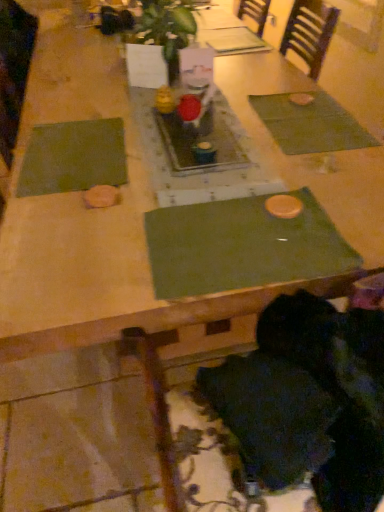
In order to face green fabric placemat at upper right, which is counted as the first place mat, starting from the right, should I rotate leftwards or rightwards?

Rotate your view right by about 15.370°.

This screenshot has height=512, width=384. What do you see at coordinates (166, 25) in the screenshot?
I see `green leafy plant at center` at bounding box center [166, 25].

What do you see at coordinates (241, 246) in the screenshot?
I see `green fabric place mat at center, which appears as the second place mat when viewed from the left` at bounding box center [241, 246].

Describe the element at coordinates (337, 389) in the screenshot. The width and height of the screenshot is (384, 512). I see `black fuzzy hair at lower right` at that location.

At what (x,y) coordinates should I click in order to perform the action: click on green fabric placemat at upper right, the 3th place mat viewed from the left. Please return your answer as a coordinate pair (x, y). Looking at the image, I should click on (310, 124).

Where is `person to the left of green fabric placemat at upper right, which is counted as the first place mat, starting from the right`? Image resolution: width=384 pixels, height=512 pixels. person to the left of green fabric placemat at upper right, which is counted as the first place mat, starting from the right is located at coordinates (337, 389).

Is black fuzzy hair at lower right at the left side of green fabric placemat at upper right, the 3th place mat viewed from the left?

Yes.

Which of these two, black fuzzy hair at lower right or green fabric placemat at upper right, the 3th place mat viewed from the left, is bigger?

black fuzzy hair at lower right is bigger.

How different are the orientations of black fuzzy hair at lower right and green fabric placemat at upper right, which is counted as the first place mat, starting from the right, in degrees?

The angular difference between black fuzzy hair at lower right and green fabric placemat at upper right, which is counted as the first place mat, starting from the right, is 92.6 degrees.

Between green leafy plant at center and green fabric place mat at left, which ranks as the 1th place mat in left-to-right order, which one has smaller width?

green leafy plant at center is thinner.

From the image's perspective, is green leafy plant at center positioned above or below green fabric place mat at left, which ranks as the 1th place mat in left-to-right order?

green leafy plant at center is above green fabric place mat at left, which ranks as the 1th place mat in left-to-right order.

Between green leafy plant at center and green fabric place mat at left, which is counted as the third place mat, starting from the right, which one has more height?

green leafy plant at center is taller.

Are black fuzzy hair at lower right and green fabric place mat at center, which appears as the second place mat when viewed from the left, far apart?

No, black fuzzy hair at lower right is not far away from green fabric place mat at center, which appears as the second place mat when viewed from the left.

From the image's perspective, between black fuzzy hair at lower right and green fabric place mat at center, which is counted as the 2th place mat, starting from the right, who is located below?

black fuzzy hair at lower right, from the image's perspective.

Is black fuzzy hair at lower right smaller than green fabric place mat at center, which appears as the second place mat when viewed from the left?

No.

Which of these two, black fuzzy hair at lower right or green fabric place mat at center, which appears as the second place mat when viewed from the left, is thinner?

With smaller width is green fabric place mat at center, which appears as the second place mat when viewed from the left.

Can you confirm if green fabric placemat at upper right, which is counted as the first place mat, starting from the right, is smaller than green leafy plant at center?

Yes.

Is green fabric placemat at upper right, the 3th place mat viewed from the left, oriented towards green leafy plant at center?

No.

From the image's perspective, is green fabric placemat at upper right, which is counted as the first place mat, starting from the right, above or below green leafy plant at center?

Based on their image positions, green fabric placemat at upper right, which is counted as the first place mat, starting from the right, is located beneath green leafy plant at center.

In the scene shown: Considering the sizes of objects green fabric placemat at upper right, the 3th place mat viewed from the left, and green leafy plant at center in the image provided, who is shorter, green fabric placemat at upper right, the 3th place mat viewed from the left, or green leafy plant at center?

With less height is green fabric placemat at upper right, the 3th place mat viewed from the left.

Can you confirm if black fuzzy hair at lower right is positioned to the left of green leafy plant at center?

In fact, black fuzzy hair at lower right is to the right of green leafy plant at center.

Is the surface of black fuzzy hair at lower right in direct contact with green leafy plant at center?

No.

Find the location of `plant above the black fuzzy hair at lower right (from a real-world perspective)`. plant above the black fuzzy hair at lower right (from a real-world perspective) is located at coordinates (166, 25).

What's the angular difference between black fuzzy hair at lower right and green leafy plant at center's facing directions?

0.224 degrees.

Between green fabric placemat at upper right, the 3th place mat viewed from the left, and green fabric place mat at center, which appears as the second place mat when viewed from the left, which one appears on the left side from the viewer's perspective?

Positioned to the left is green fabric place mat at center, which appears as the second place mat when viewed from the left.

From a real-world perspective, is green fabric placemat at upper right, the 3th place mat viewed from the left, physically below green fabric place mat at center, which appears as the second place mat when viewed from the left?

Yes, from a real-world perspective, green fabric placemat at upper right, the 3th place mat viewed from the left, is beneath green fabric place mat at center, which appears as the second place mat when viewed from the left.

How different are the orientations of green fabric placemat at upper right, which is counted as the first place mat, starting from the right, and green fabric place mat at center, which appears as the second place mat when viewed from the left, in degrees?

The angle between the facing direction of green fabric placemat at upper right, which is counted as the first place mat, starting from the right, and the facing direction of green fabric place mat at center, which appears as the second place mat when viewed from the left, is 89.8 degrees.

Is green fabric placemat at upper right, which is counted as the first place mat, starting from the right, not close to green fabric place mat at center, which appears as the second place mat when viewed from the left?

No, green fabric placemat at upper right, which is counted as the first place mat, starting from the right, is not far away from green fabric place mat at center, which appears as the second place mat when viewed from the left.

Can you confirm if green fabric place mat at center, which is counted as the 2th place mat, starting from the right, is bigger than green fabric place mat at left, which ranks as the 1th place mat in left-to-right order?

Yes, green fabric place mat at center, which is counted as the 2th place mat, starting from the right, is bigger than green fabric place mat at left, which ranks as the 1th place mat in left-to-right order.

Is green fabric place mat at center, which appears as the second place mat when viewed from the left, facing away from green fabric place mat at left, which ranks as the 1th place mat in left-to-right order?

That's right, green fabric place mat at center, which appears as the second place mat when viewed from the left, is facing away from green fabric place mat at left, which ranks as the 1th place mat in left-to-right order.

Find the location of a particular element. place mat that is the 1st one when counting upward from the green fabric place mat at center, which is counted as the 2th place mat, starting from the right (from the image's perspective) is located at coordinates (73, 157).

Find the location of a particular element. This screenshot has width=384, height=512. place mat lying on the right of black fuzzy hair at lower right is located at coordinates (310, 124).

I want to click on place mat on the left of green leafy plant at center, so click(x=73, y=157).

Which object lies further to the anchor point green fabric placemat at upper right, the 3th place mat viewed from the left, black fuzzy hair at lower right or green fabric place mat at left, which ranks as the 1th place mat in left-to-right order?

Based on the image, black fuzzy hair at lower right appears to be further to green fabric placemat at upper right, the 3th place mat viewed from the left.

Estimate the real-world distances between objects in this image. Which object is closer to black fuzzy hair at lower right, green leafy plant at center or green fabric place mat at left, which ranks as the 1th place mat in left-to-right order?

Among the two, green fabric place mat at left, which ranks as the 1th place mat in left-to-right order, is located nearer to black fuzzy hair at lower right.

Looking at the image, which one is located closer to black fuzzy hair at lower right, green fabric place mat at center, which is counted as the 2th place mat, starting from the right, or green fabric place mat at left, which ranks as the 1th place mat in left-to-right order?

Based on the image, green fabric place mat at center, which is counted as the 2th place mat, starting from the right, appears to be nearer to black fuzzy hair at lower right.

When comparing their distances from green leafy plant at center, does green fabric placemat at upper right, which is counted as the first place mat, starting from the right, or black fuzzy hair at lower right seem closer?

green fabric placemat at upper right, which is counted as the first place mat, starting from the right, lies closer to green leafy plant at center than the other object.

Based on their spatial positions, is green fabric place mat at left, which is counted as the third place mat, starting from the right, or black fuzzy hair at lower right further from green leafy plant at center?

black fuzzy hair at lower right.

Which object lies further to the anchor point green leafy plant at center, green fabric place mat at left, which is counted as the third place mat, starting from the right, or green fabric placemat at upper right, which is counted as the first place mat, starting from the right?

The object further to green leafy plant at center is green fabric place mat at left, which is counted as the third place mat, starting from the right.

Based on their spatial positions, is green leafy plant at center or green fabric place mat at left, which is counted as the third place mat, starting from the right, closer to green fabric placemat at upper right, the 3th place mat viewed from the left?

green leafy plant at center is closer to green fabric placemat at upper right, the 3th place mat viewed from the left.

Looking at the image, which one is located further to green fabric placemat at upper right, the 3th place mat viewed from the left, green fabric place mat at left, which is counted as the third place mat, starting from the right, or green fabric place mat at center, which is counted as the 2th place mat, starting from the right?

The object further to green fabric placemat at upper right, the 3th place mat viewed from the left, is green fabric place mat at left, which is counted as the third place mat, starting from the right.

Identify the location of place mat between green fabric place mat at left, which ranks as the 1th place mat in left-to-right order, and black fuzzy hair at lower right from left to right. This screenshot has width=384, height=512. coord(241,246).

This screenshot has height=512, width=384. Find the location of `person situated between green fabric place mat at left, which is counted as the third place mat, starting from the right, and green fabric placemat at upper right, the 3th place mat viewed from the left, from left to right`. person situated between green fabric place mat at left, which is counted as the third place mat, starting from the right, and green fabric placemat at upper right, the 3th place mat viewed from the left, from left to right is located at coordinates (337, 389).

You are a GUI agent. You are given a task and a screenshot of the screen. Output one action in this format:
    pyautogui.click(x=<x>, y=<y>)
    Task: Click on the plant between green fabric place mat at left, which ranks as the 1th place mat in left-to-right order, and green fabric placemat at upper right, the 3th place mat viewed from the left
    The image size is (384, 512).
    Given the screenshot: What is the action you would take?
    pyautogui.click(x=166, y=25)

I want to click on place mat between green fabric place mat at left, which ranks as the 1th place mat in left-to-right order, and green fabric placemat at upper right, the 3th place mat viewed from the left, from left to right, so click(241, 246).